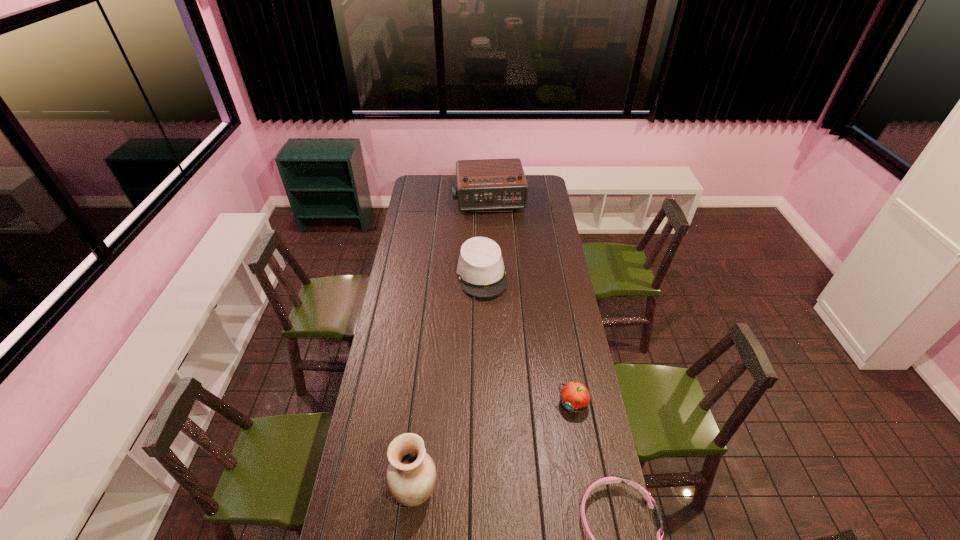
Where is `vacant area that lies between the tallest object and the second farthest object`? The width and height of the screenshot is (960, 540). vacant area that lies between the tallest object and the second farthest object is located at coordinates (448, 383).

At what (x,y) coordinates should I click in order to perform the action: click on object that stands as the third closest to the fourth shortest object. Please return your answer as a coordinate pair (x, y). The image size is (960, 540). Looking at the image, I should click on (411, 474).

Identify the location of the third closest object to the fourth nearest object. This screenshot has height=540, width=960. (411, 474).

The image size is (960, 540). I want to click on blank area in the image that satisfies the following two spatial constraints: 1. on the back side of the tallest object; 2. on the right side of the third farthest object, so click(x=424, y=404).